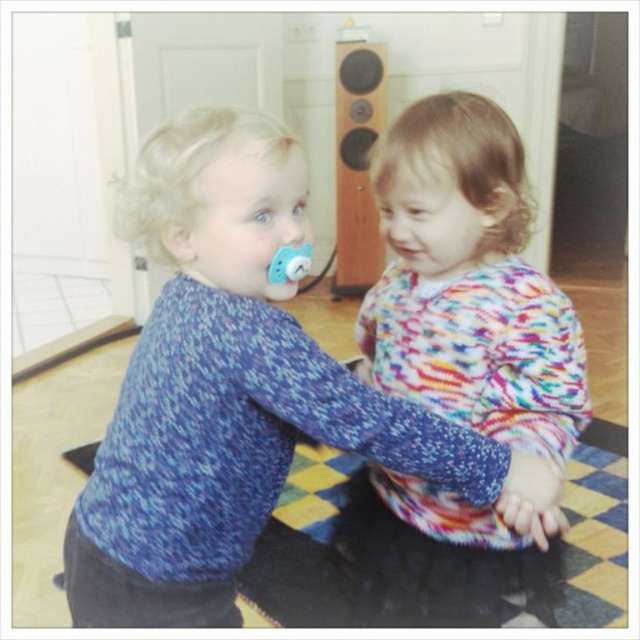
Does point (552, 305) lie behind point (282, 276)?

That is True.

Is the position of multicolored knit sweater at center less distant than that of matte blue pacifier at left?

Yes, it is.

Is point (406, 488) farther from viewer compared to point (284, 253)?

Yes, it is.

The height and width of the screenshot is (640, 640). What are the coordinates of `multicolored knit sweater at center` in the screenshot? It's located at (468, 284).

Which of these two, wooden speaker at upper center or pink matte lips at center, stands taller?

With more height is wooden speaker at upper center.

Where is `wooden speaker at upper center`? wooden speaker at upper center is located at coordinates (356, 164).

Can you confirm if blue knitted sweater at center is shorter than pink matte lips at center?

No.

Can you confirm if blue knitted sweater at center is positioned to the left of pink matte lips at center?

Yes, blue knitted sweater at center is to the left of pink matte lips at center.

The image size is (640, 640). What do you see at coordinates (326, 355) in the screenshot?
I see `blue knitted sweater at center` at bounding box center [326, 355].

At what (x,y) coordinates should I click in order to perform the action: click on blue knitted sweater at center. Please return your answer as a coordinate pair (x, y). Looking at the image, I should click on (326, 355).